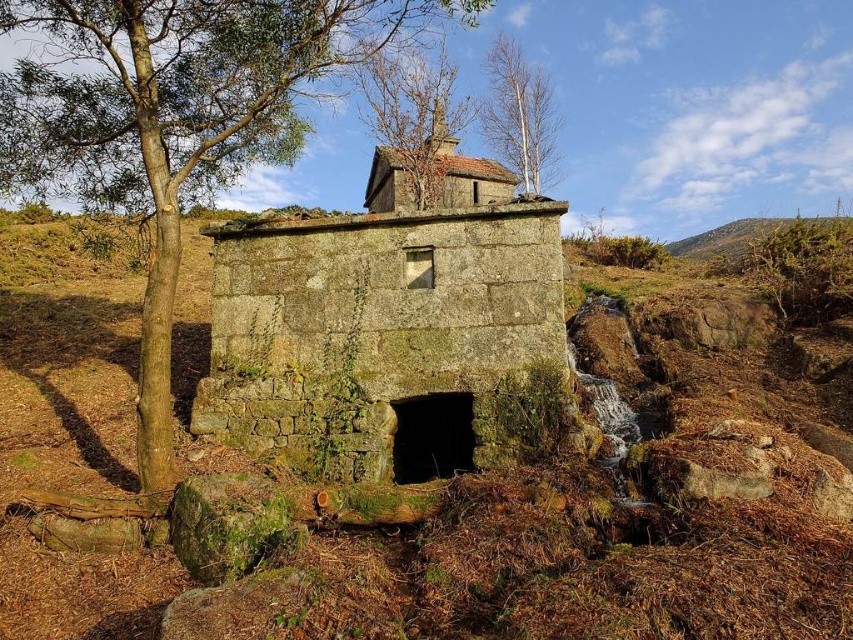
Can you confirm if bare wood tree at upper center is positioned to the left of green mossy hillside at upper right?

Yes, bare wood tree at upper center is to the left of green mossy hillside at upper right.

The width and height of the screenshot is (853, 640). In order to click on bare wood tree at upper center in this screenshot , I will do `click(519, 115)`.

Based on the photo, who is more distant from viewer, (496, 65) or (753, 236)?

Positioned behind is point (496, 65).

Locate an element on the screen. bare wood tree at upper center is located at coordinates (519, 115).

Between green mossy stone structure at center and brown leafy tree at upper center, which one appears on the left side from the viewer's perspective?

Positioned to the left is green mossy stone structure at center.

Does point (492, 536) lie behind point (395, 164)?

No, (492, 536) is closer to viewer.

The height and width of the screenshot is (640, 853). Find the location of `green mossy stone structure at center`. green mossy stone structure at center is located at coordinates (602, 524).

Locate an element on the screen. The width and height of the screenshot is (853, 640). green mossy stone structure at center is located at coordinates (602, 524).

Can you confirm if green mossy stone structure at center is positioned to the left of bare wood tree at upper center?

Correct, you'll find green mossy stone structure at center to the left of bare wood tree at upper center.

Does green mossy stone structure at center have a greater height compared to bare wood tree at upper center?

In fact, green mossy stone structure at center may be shorter than bare wood tree at upper center.

Who is more distant from viewer, (x=180, y=602) or (x=517, y=106)?

Point (x=517, y=106)

You are a GUI agent. You are given a task and a screenshot of the screen. Output one action in this format:
    pyautogui.click(x=<x>, y=<y>)
    Task: Click on the green mossy stone structure at center
    
    Given the screenshot: What is the action you would take?
    pyautogui.click(x=602, y=524)